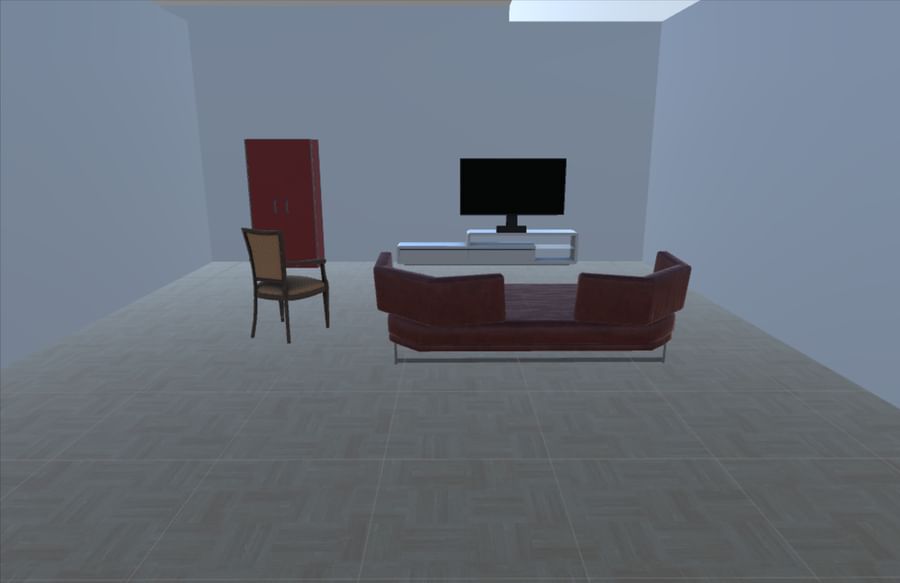
Locate an element on the screen. The image size is (900, 583). handle is located at coordinates (286, 206), (273, 213).